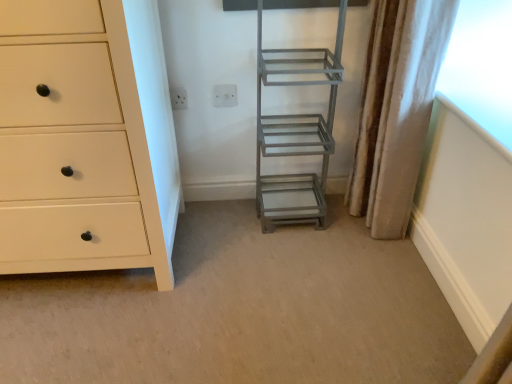
Where is `vacant space in between metallic gray ladder at center and white matte chest of drawers at left`? vacant space in between metallic gray ladder at center and white matte chest of drawers at left is located at coordinates (233, 233).